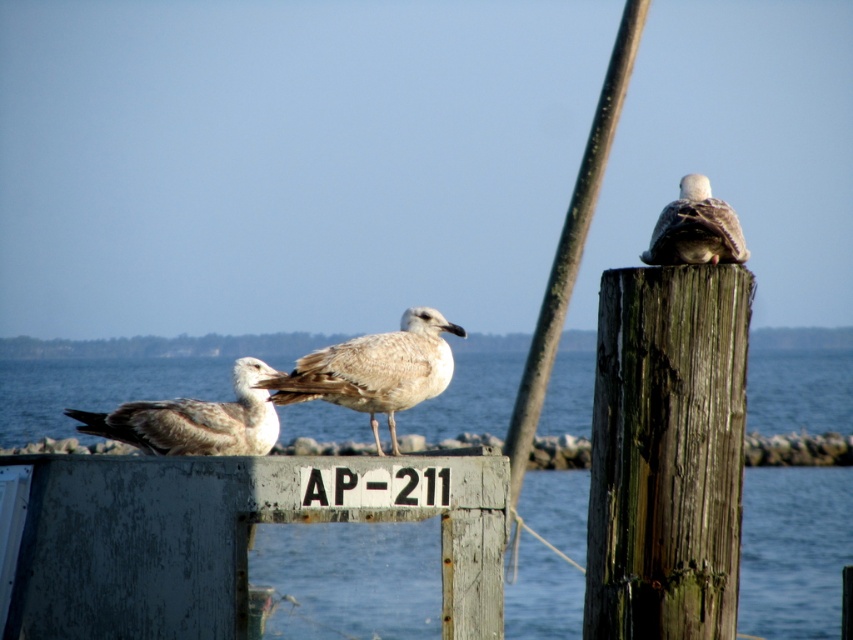
You are a birdwatcher observing the scene. You notice the weathered wood post at upper right and the light brown feathered seagull at center. Which object is larger in size?

The light brown feathered seagull at center is larger than the weathered wood post at upper right.

You are standing on the beach looking at the wooden post and the concrete structure. Which of the two points, point [811,566] or point [680,257], is closer to you?

Point [811,566] is closer to you because it is further to the viewer than point [680,257].